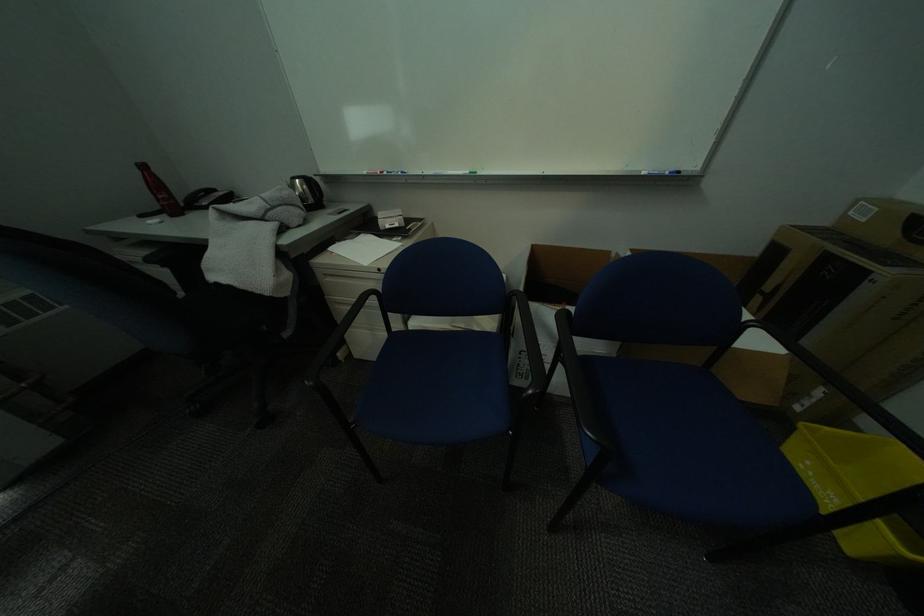
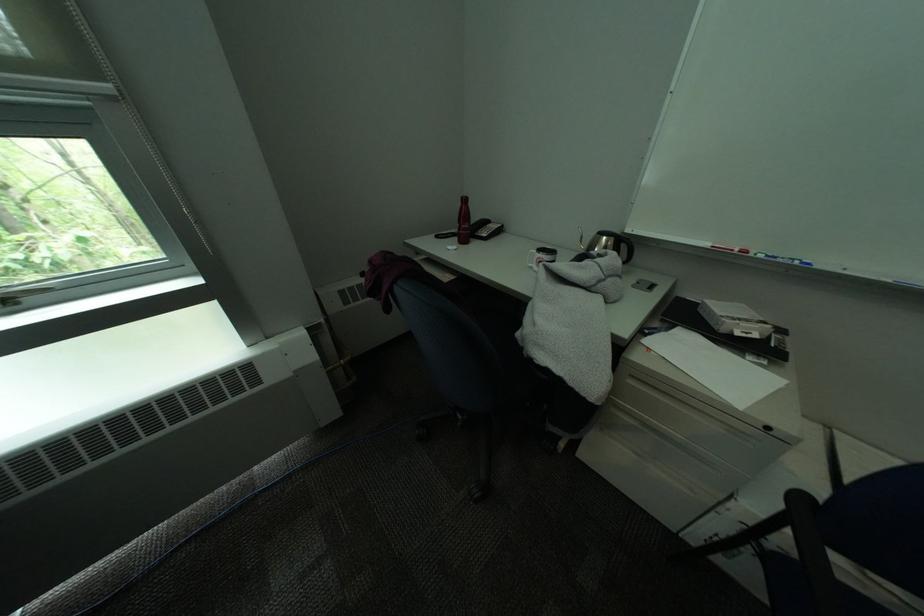
Where in the second image is the point corresponding to point (405, 175) from the first image?

(791, 262)